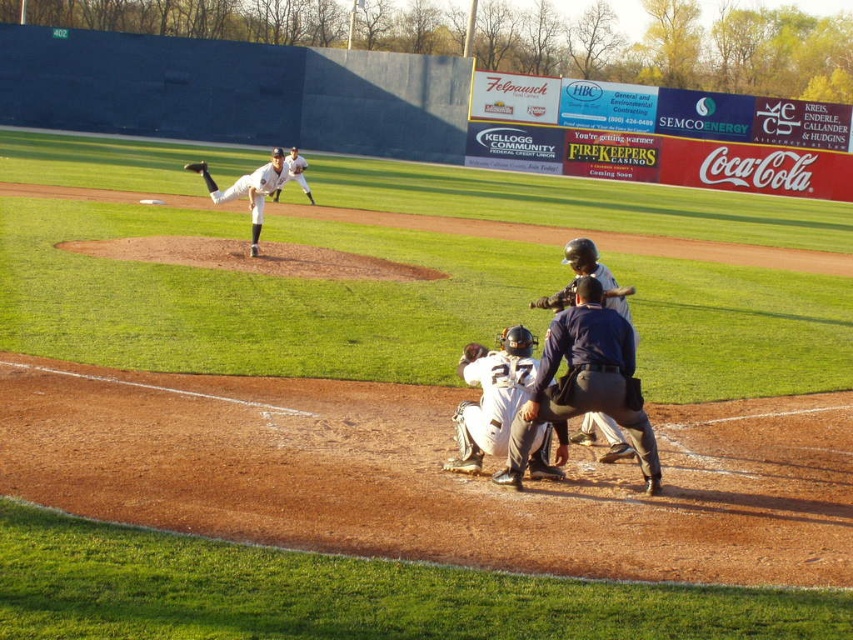
Question: Among these objects, which one is farthest from the camera?

Choices:
 (A) dark blue uniform at center
 (B) wooden bat at lower center
 (C) brown leather glove at upper center
 (D) matte blue umpire at center

Answer: (C)

Question: Where is white uniformed pitcher at center located in relation to wooden bat at lower center in the image?

Choices:
 (A) right
 (B) left

Answer: (B)

Question: Does white matte uniform at lower center have a larger size compared to wooden bat at lower center?

Choices:
 (A) no
 (B) yes

Answer: (A)

Question: Estimate the real-world distances between objects in this image. Which object is farther from the white matte uniform at lower center?

Choices:
 (A) white uniform at center
 (B) white uniformed pitcher at center
 (C) wooden bat at lower center

Answer: (A)

Question: Which point is farther from the camera taking this photo?

Choices:
 (A) (608, 269)
 (B) (503, 372)
 (C) (537, 424)

Answer: (A)

Question: Can you confirm if matte blue umpire at center is smaller than white uniformed pitcher at center?

Choices:
 (A) yes
 (B) no

Answer: (A)